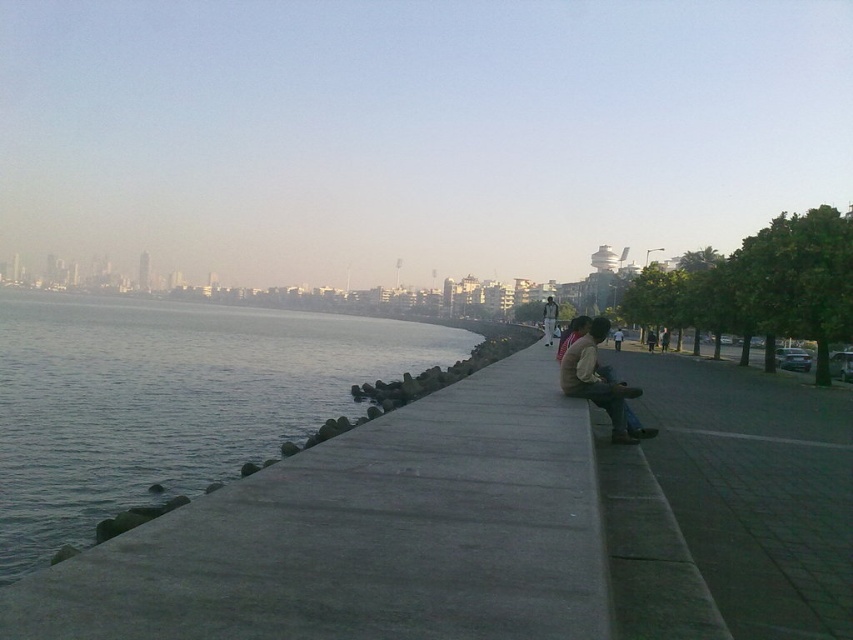
Question: Does brown leather jacket at center have a larger size compared to matte brown jacket at center?

Choices:
 (A) no
 (B) yes

Answer: (A)

Question: From the image, what is the correct spatial relationship of gray concrete waterway at lower left in relation to brown leather jacket at center?

Choices:
 (A) right
 (B) left

Answer: (B)

Question: Which object is farther from the camera taking this photo?

Choices:
 (A) gray concrete waterway at lower left
 (B) brown leather jacket at center

Answer: (B)

Question: Among these objects, which one is farthest from the camera?

Choices:
 (A) gray concrete waterway at lower left
 (B) brown leather jacket at center

Answer: (B)

Question: Among these objects, which one is farthest from the camera?

Choices:
 (A) brown leather jacket at center
 (B) gray concrete waterway at lower left

Answer: (A)

Question: Where is brown leather jacket at center located in relation to matte brown jacket at center in the image?

Choices:
 (A) right
 (B) left

Answer: (B)